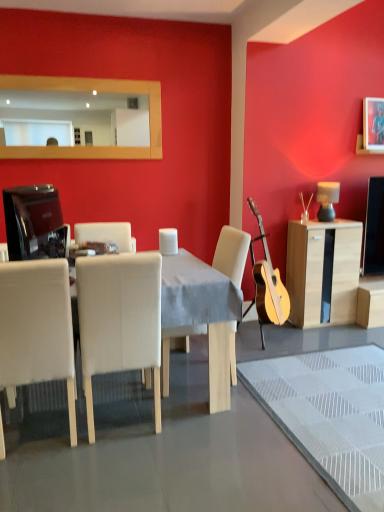
Question: Does point (173, 334) appear closer or farther from the camera than point (91, 148)?

Choices:
 (A) closer
 (B) farther

Answer: (A)

Question: Visually, is white fabric chair at center, which ranks as the first chair in right-to-left order, positioned to the left or to the right of wooden frame mirror at upper center?

Choices:
 (A) right
 (B) left

Answer: (A)

Question: Based on their relative distances, which object is farther from the white leather table at center?

Choices:
 (A) white leather chair at left, the third chair positioned from the right
 (B) metallic silver picture frame at upper right
 (C) white fabric chair at center, the 2th chair when ordered from left to right
 (D) wooden frame mirror at upper center
 (E) light wood cabinet at right

Answer: (B)

Question: Estimate the real-world distances between objects in this image. Which object is farther from the white fabric chair at center, which ranks as the first chair in right-to-left order?

Choices:
 (A) matte black lamp at right
 (B) wooden frame mirror at upper center
 (C) metallic silver picture frame at upper right
 (D) white leather table at center
 (E) matte black television at left

Answer: (C)